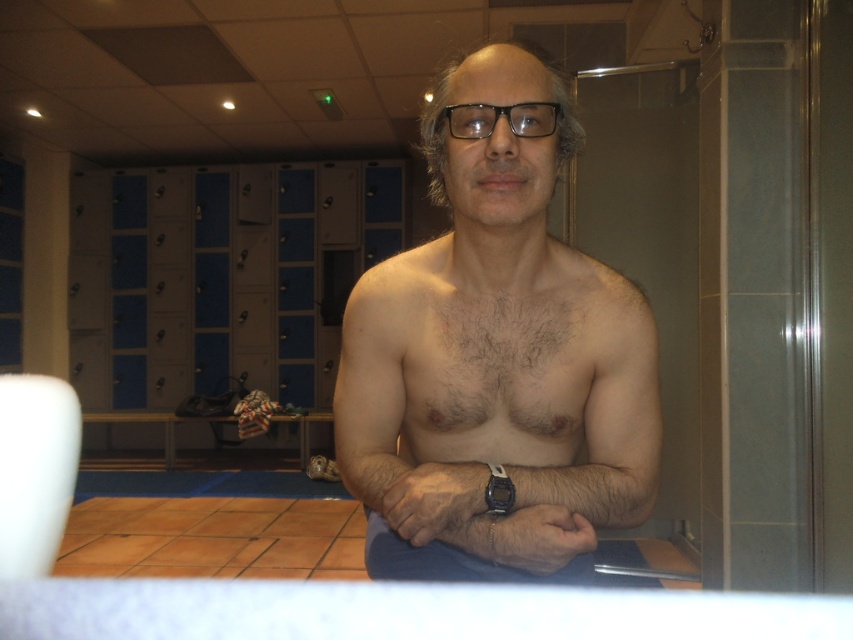
Is hairy skin at center to the left of brown hairy chest at center from the viewer's perspective?

No, hairy skin at center is not to the left of brown hairy chest at center.

At what (x,y) coordinates should I click in order to perform the action: click on hairy skin at center. Please return your answer as a coordinate pair (x, y). Image resolution: width=853 pixels, height=640 pixels. Looking at the image, I should click on (575, 403).

The image size is (853, 640). I want to click on hairy skin at center, so click(x=575, y=403).

Who is shorter, brown hairy chest at center or black plastic glasses at center?

black plastic glasses at center

Does point (547, 346) come closer to viewer compared to point (541, 104)?

No, (547, 346) is behind (541, 104).

Between point (572, 324) and point (494, 109), which one is positioned behind?

Point (572, 324)

Find the location of a particular element. Image resolution: width=853 pixels, height=640 pixels. brown hairy chest at center is located at coordinates (498, 364).

Can you confirm if hairy skin at center is taller than black plastic glasses at center?

Indeed, hairy skin at center has a greater height compared to black plastic glasses at center.

How far apart are hairy skin at center and black plastic glasses at center?

13.24 inches

Who is more forward, (578, 301) or (456, 106)?

Point (456, 106) is more forward.

Identify the location of hairy skin at center. The image size is (853, 640). (575, 403).